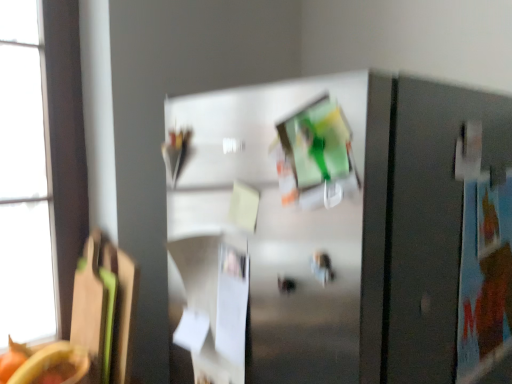
The image size is (512, 384). I want to click on satin silver fridge at center, so click(284, 227).

What do you see at coordinates (284, 227) in the screenshot? This screenshot has width=512, height=384. I see `satin silver fridge at center` at bounding box center [284, 227].

Identify the location of satin silver fridge at center. Image resolution: width=512 pixels, height=384 pixels. (284, 227).